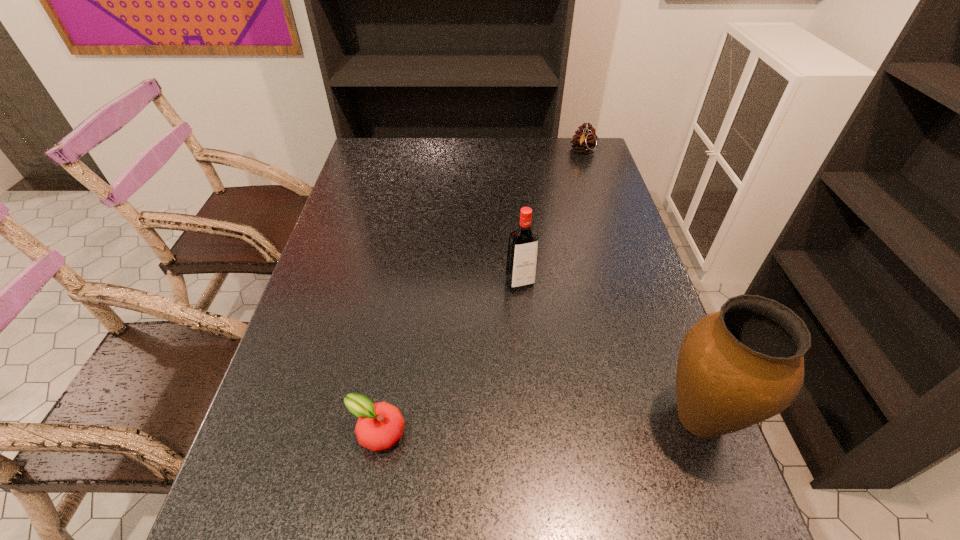
The height and width of the screenshot is (540, 960). In order to click on free region located 0.250m on the front and back of the second farthest object in this screenshot , I will do `click(563, 370)`.

This screenshot has width=960, height=540. Identify the location of free region located 0.230m on the front and back of the second farthest object. (559, 363).

Identify the location of free location located with a leaf charm attached to the farthest object. (568, 207).

Identify the location of free location located 0.050m with a leaf charm attached to the farthest object. Image resolution: width=960 pixels, height=540 pixels. (580, 166).

Identify the location of free space located 0.260m with a leaf charm attached to the farthest object. (571, 198).

Find the location of a particular element. This screenshot has height=540, width=960. object located in the far edge section of the desktop is located at coordinates (585, 139).

At what (x,y) coordinates should I click in order to perform the action: click on apple present at the near edge. Please return your answer as a coordinate pair (x, y). Image resolution: width=960 pixels, height=540 pixels. Looking at the image, I should click on (380, 425).

Locate an element on the screen. The height and width of the screenshot is (540, 960). urn present at the near edge is located at coordinates (744, 364).

The image size is (960, 540). What are the coordinates of `urn that is at the right edge` in the screenshot? It's located at click(x=744, y=364).

This screenshot has height=540, width=960. Find the location of `pinecone present at the right edge`. pinecone present at the right edge is located at coordinates (585, 139).